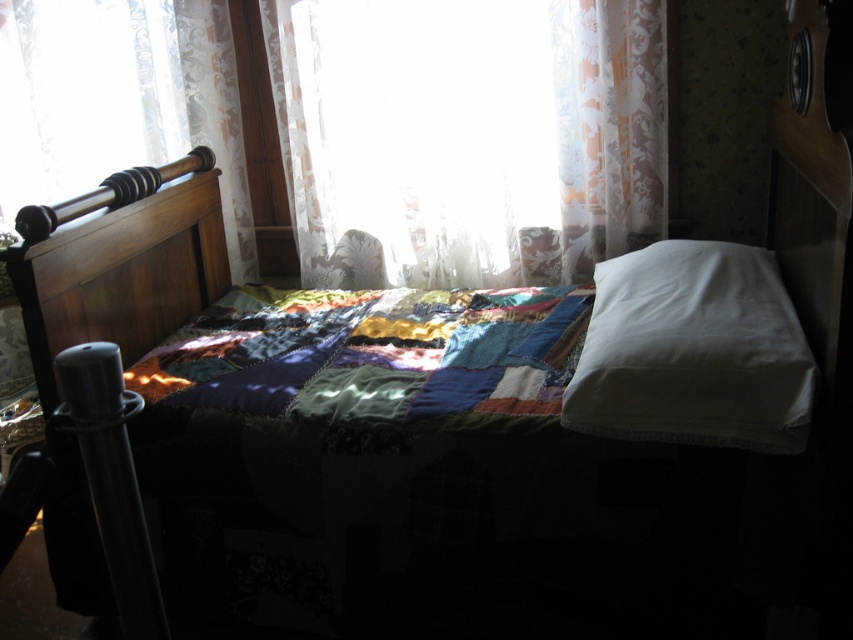
Question: Does patchwork fabric quilt at center lie in front of white smooth pillow at center?

Choices:
 (A) no
 (B) yes

Answer: (A)

Question: Is translucent floral fabric at center below wooden headboard at left?

Choices:
 (A) yes
 (B) no

Answer: (B)

Question: Can you confirm if translucent floral fabric at center is positioned to the left of white smooth pillow at center?

Choices:
 (A) yes
 (B) no

Answer: (A)

Question: Among these points, which one is farthest from the camera?

Choices:
 (A) (137, 376)
 (B) (160, 221)
 (C) (633, 81)
 (D) (717, 285)

Answer: (C)

Question: Which point appears farthest from the camera in this image?

Choices:
 (A) (734, 344)
 (B) (425, 248)

Answer: (B)

Question: Which object appears farthest from the camera in this image?

Choices:
 (A) wooden headboard at left
 (B) translucent floral fabric at center
 (C) patchwork fabric quilt at center
 (D) white lace curtain at upper center

Answer: (B)